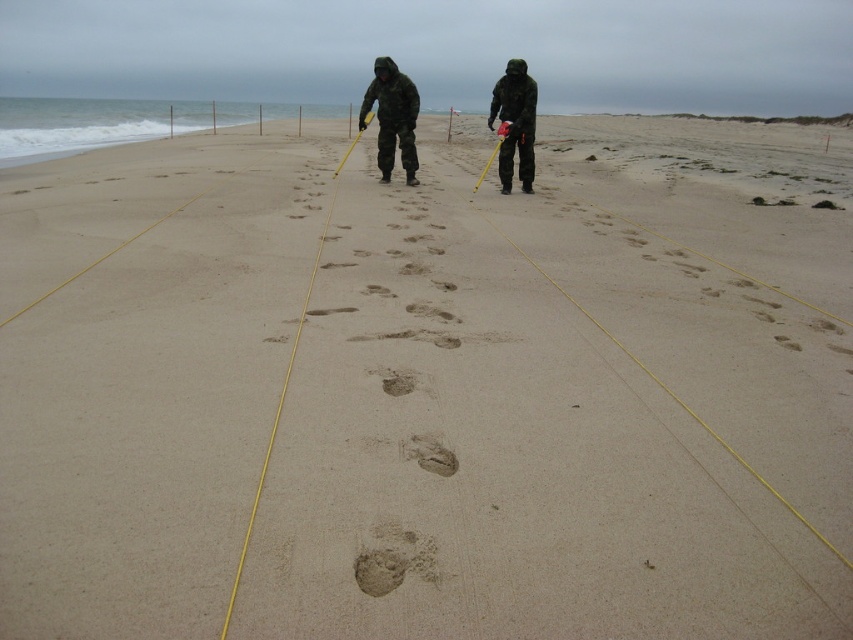
You are a hiker who wants to avoid getting your shoes dirty. You see the camouflage fabric jacket at center and the brown sandy footprint at center. Which object is closer to you, and should you step around it to keep your shoes clean?

The camouflage fabric jacket at center is closer to you than the brown sandy footprint at center. To keep your shoes clean, you should step around the camouflage fabric jacket at center since it is closer and likely on the path.